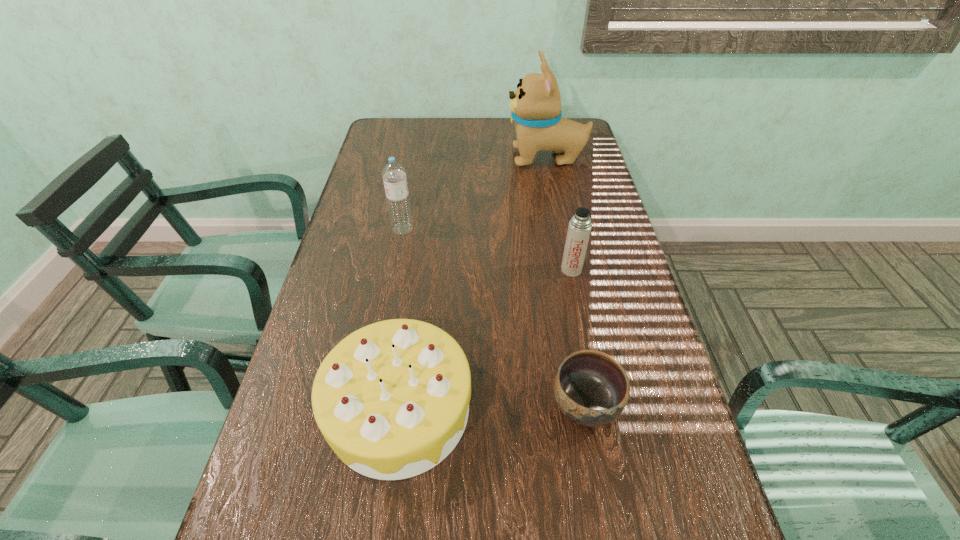
At what (x,y) coordinates should I click in order to perform the action: click on object located at the far right corner. Please return your answer as a coordinate pair (x, y). This screenshot has height=540, width=960. Looking at the image, I should click on (535, 107).

Locate an element on the screen. Image resolution: width=960 pixels, height=540 pixels. vacant space at the far edge of the desktop is located at coordinates (480, 137).

In the image, there is a desktop. Where is `free space at the left edge`? free space at the left edge is located at coordinates (314, 511).

Find the location of a particular element. The width and height of the screenshot is (960, 540). vacant space at the right edge of the desktop is located at coordinates (559, 212).

This screenshot has height=540, width=960. What are the coordinates of `vacant space at the far left corner` in the screenshot? It's located at (388, 124).

This screenshot has width=960, height=540. I want to click on free spot between the birthday cake and the third nearest object, so click(486, 340).

Where is `free space between the bowl and the water bottle`? The height and width of the screenshot is (540, 960). free space between the bowl and the water bottle is located at coordinates (493, 316).

Identify the location of free area in between the shortest object and the water bottle. point(493,316).

The width and height of the screenshot is (960, 540). Find the location of `empty location between the third farthest object and the puppy`. empty location between the third farthest object and the puppy is located at coordinates (559, 214).

In order to click on vacant area between the birthday cake and the tallest object in this screenshot , I will do `click(473, 284)`.